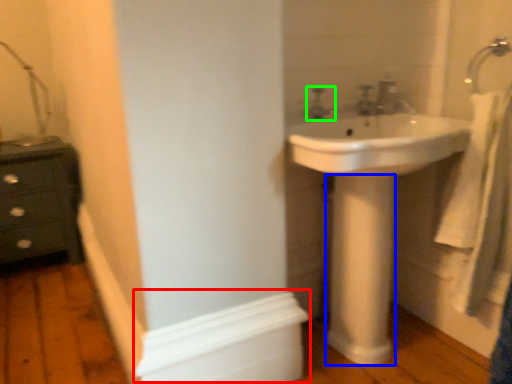
Question: Based on their relative distances, which object is farther from molding (highlighted by a red box)? Choose from pillar (highlighted by a blue box) and tap (highlighted by a green box).

Choices:
 (A) pillar
 (B) tap

Answer: (B)